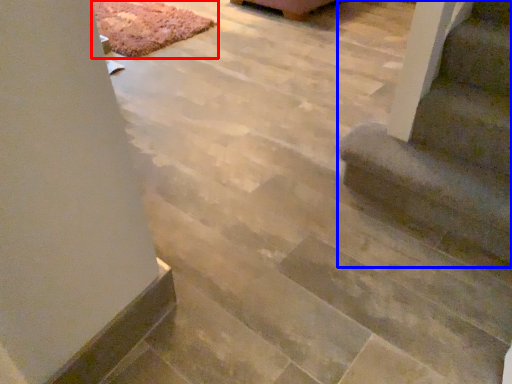
Question: Among these objects, which one is nearest to the camera, mat (highlighted by a red box) or stairs (highlighted by a blue box)?

Choices:
 (A) mat
 (B) stairs

Answer: (B)